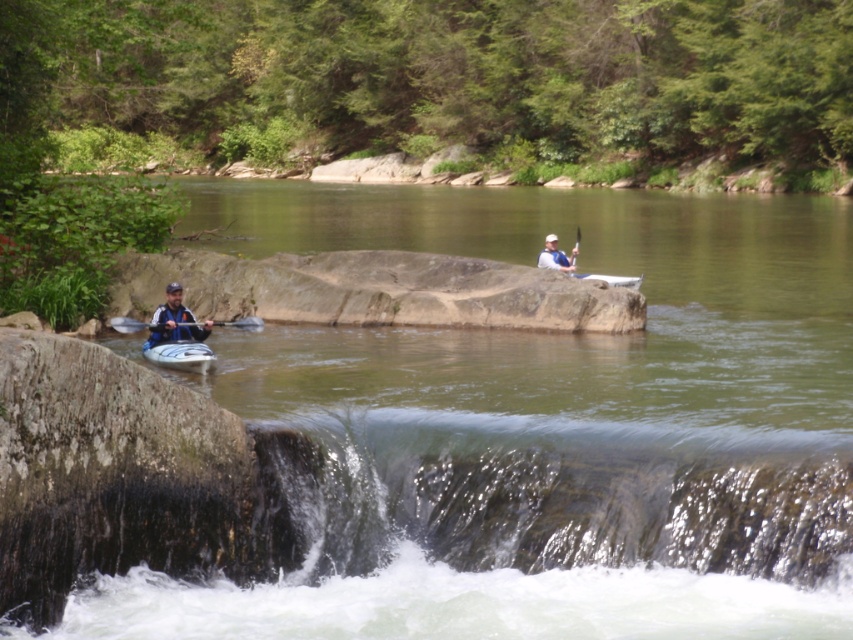
Question: Which of the following is the farthest from the observer?

Choices:
 (A) blue plastic paddle at left
 (B) white glossy kayak at lower left
 (C) smooth blue paddle at upper center
 (D) white plastic canoe at center

Answer: (C)

Question: Can you confirm if green smooth river at center is positioned to the right of white plastic canoe at center?

Choices:
 (A) no
 (B) yes

Answer: (A)

Question: Considering the real-world distances, which object is farthest from the white matte kayak at upper center?

Choices:
 (A) green smooth river at center
 (B) white plastic canoe at center
 (C) matte blue kayak at left

Answer: (A)

Question: Is the position of white matte kayak at upper center more distant than that of smooth blue paddle at upper center?

Choices:
 (A) no
 (B) yes

Answer: (A)

Question: Considering the real-world distances, which object is farthest from the white matte kayak at upper center?

Choices:
 (A) blue plastic paddle at left
 (B) smooth blue paddle at upper center
 (C) white glossy kayak at lower left

Answer: (C)

Question: Is green smooth river at center to the right of blue plastic paddle at left from the viewer's perspective?

Choices:
 (A) no
 (B) yes

Answer: (B)